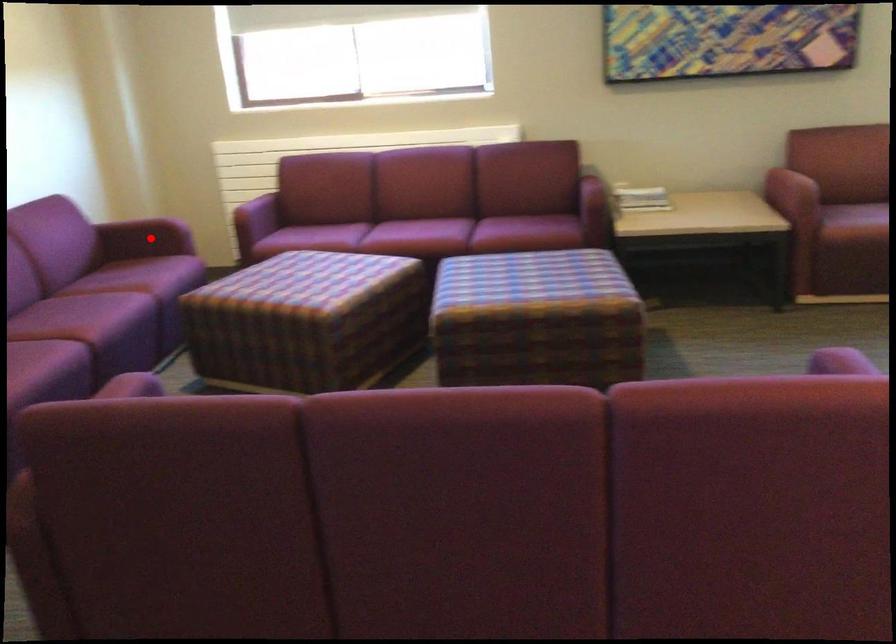
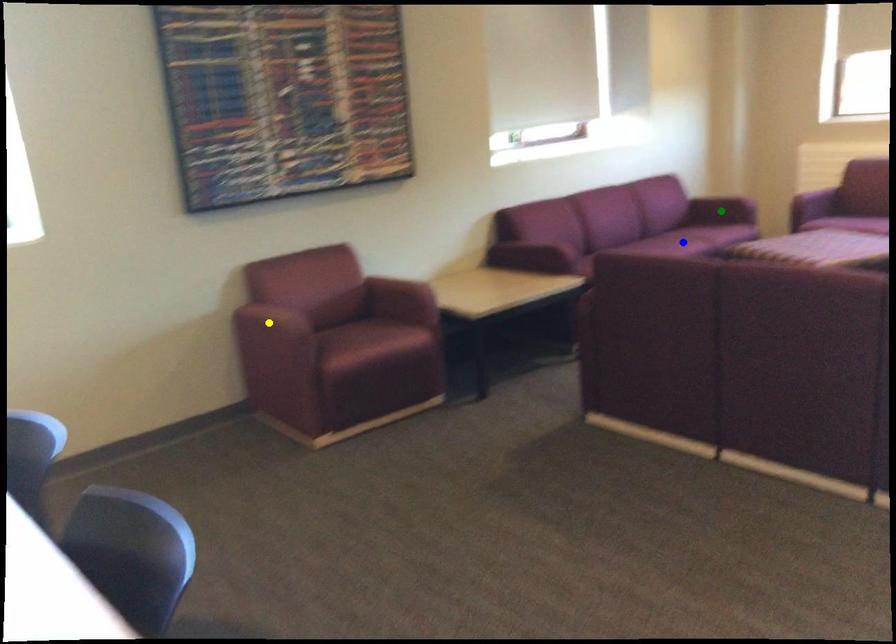
Question: I am providing you with two images of the same scene from different viewpoints. A red point is marked on the first image. You are given multiple points on the second image. Which spot in image 2 lines up with the point in image 1?

Choices:
 (A) blue point
 (B) green point
 (C) yellow point

Answer: (B)